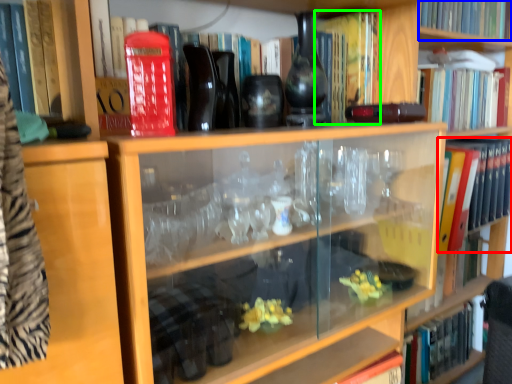
Question: Considering the real-world distances, which object is closest to book (highlighted by a red box)? book (highlighted by a blue box) or book (highlighted by a green box).

Choices:
 (A) book
 (B) book

Answer: (A)